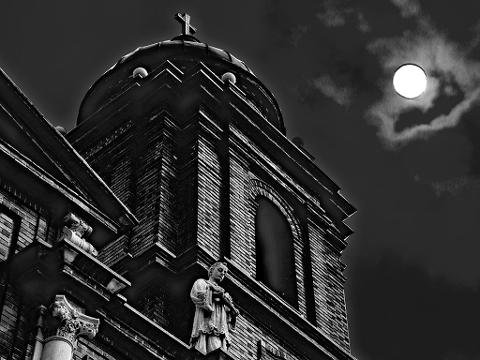
Image resolution: width=480 pixels, height=360 pixels. Find the location of `pillar`. pillar is located at coordinates (56, 346).